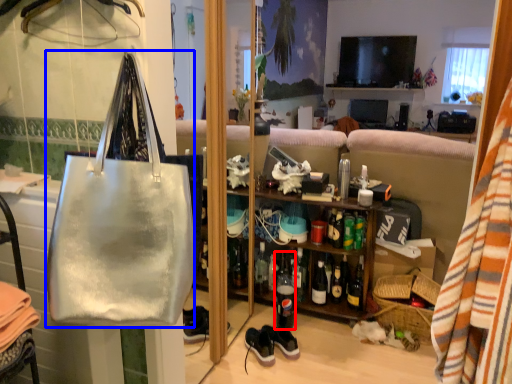
Question: Among these objects, which one is nearest to the camera, bottle (highlighted by a red box) or handbag (highlighted by a blue box)?

Choices:
 (A) bottle
 (B) handbag

Answer: (B)